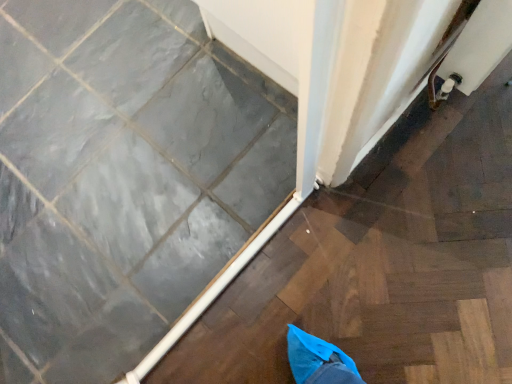
Question: Does slate gray ceramic tile at lower left contain white glossy door at upper center?

Choices:
 (A) no
 (B) yes

Answer: (A)

Question: From a real-world perspective, is slate gray ceramic tile at lower left located higher than white glossy door at upper center?

Choices:
 (A) no
 (B) yes

Answer: (B)

Question: Considering the relative positions of slate gray ceramic tile at lower left and white glossy door at upper center in the image provided, is slate gray ceramic tile at lower left to the left of white glossy door at upper center from the viewer's perspective?

Choices:
 (A) yes
 (B) no

Answer: (A)

Question: From the image's perspective, is slate gray ceramic tile at lower left on top of white glossy door at upper center?

Choices:
 (A) no
 (B) yes

Answer: (B)

Question: Does slate gray ceramic tile at lower left come behind white glossy door at upper center?

Choices:
 (A) no
 (B) yes

Answer: (B)

Question: From a real-world perspective, is slate gray ceramic tile at lower left under white glossy door at upper center?

Choices:
 (A) no
 (B) yes

Answer: (A)

Question: Is white glossy door at upper center far away from slate gray ceramic tile at lower left?

Choices:
 (A) yes
 (B) no

Answer: (B)

Question: From the image's perspective, is white glossy door at upper center on top of slate gray ceramic tile at lower left?

Choices:
 (A) yes
 (B) no

Answer: (B)

Question: Could you tell me if white glossy door at upper center is turned towards slate gray ceramic tile at lower left?

Choices:
 (A) no
 (B) yes

Answer: (B)

Question: Does white glossy door at upper center have a larger size compared to slate gray ceramic tile at lower left?

Choices:
 (A) yes
 (B) no

Answer: (B)

Question: Does white glossy door at upper center have a lesser height compared to slate gray ceramic tile at lower left?

Choices:
 (A) yes
 (B) no

Answer: (A)

Question: From the image's perspective, is white glossy door at upper center under slate gray ceramic tile at lower left?

Choices:
 (A) yes
 (B) no

Answer: (A)

Question: From the image's perspective, is white glossy door at upper center positioned above or below slate gray ceramic tile at lower left?

Choices:
 (A) above
 (B) below

Answer: (B)